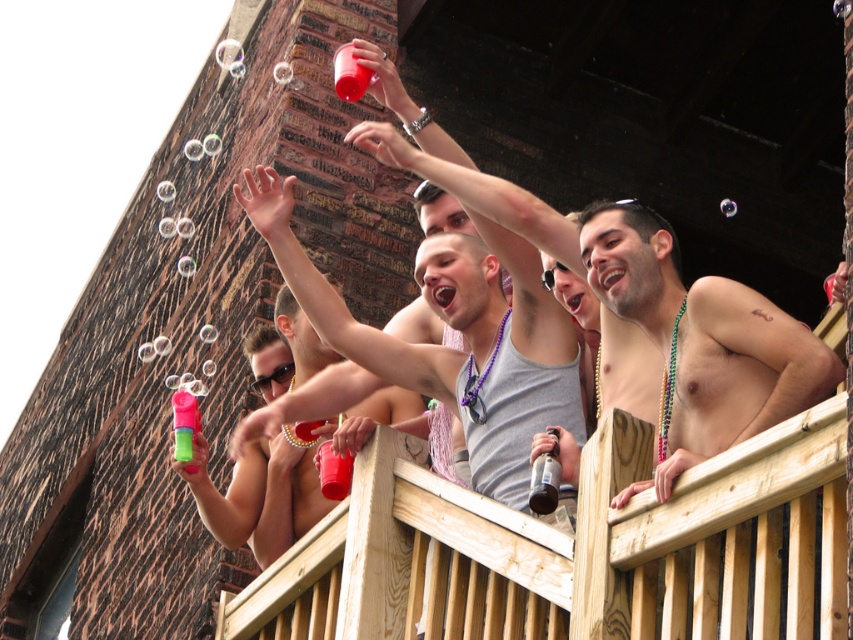
You are a photographer standing at the base of the balcony. You want to take a photo that includes both the shiny metallic can at center and the shiny skin at upper right. Given that your camera has a maximum zoom range that can capture objects up to 30 inches apart, will you be able to fit both objects in the same frame without moving closer?

The shiny metallic can at center and shiny skin at upper right are 34.36 inches apart from each other. Since the distance between them exceeds the camera maximum zoom range of 30 inches, you will not be able to fit both objects in the same frame without moving closer.

You are standing in front of the balcony where the men are gathered. There are two points marked on the balcony floor, one at coordinates point (445, 401) and the other at point (187, 426). Which point is closer to you?

Point (445, 401) is closer to the viewer than point (187, 426).

You are a photographer trying to capture the scene from the balcony. You notice the shiny metallic can at center and the shiny skin at upper right. Which object should you focus on first if you want to photograph the one closer to the left side of your frame?

The shiny metallic can at center is to the left of shiny skin at upper right, so you should focus on the shiny metallic can at center first since it is closer to the left side of your frame.